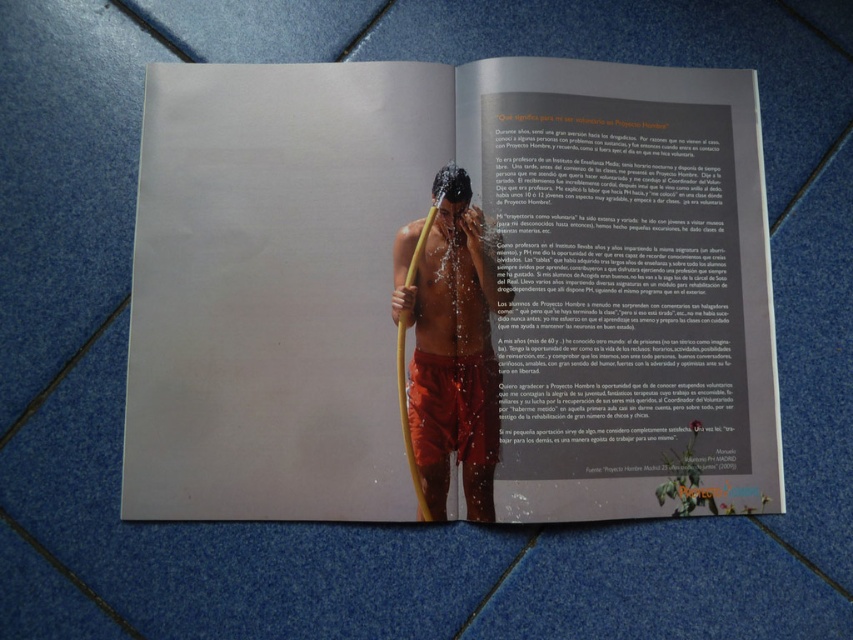
From the picture: Does matte yellow hose at center appear over shiny orange shorts at center?

Indeed, matte yellow hose at center is positioned over shiny orange shorts at center.

Is matte yellow hose at center thinner than shiny orange shorts at center?

Incorrect, matte yellow hose at center's width is not less than shiny orange shorts at center's.

Who is more forward, (212, 435) or (506, 307)?

Positioned in front is point (212, 435).

I want to click on matte yellow hose at center, so click(x=450, y=292).